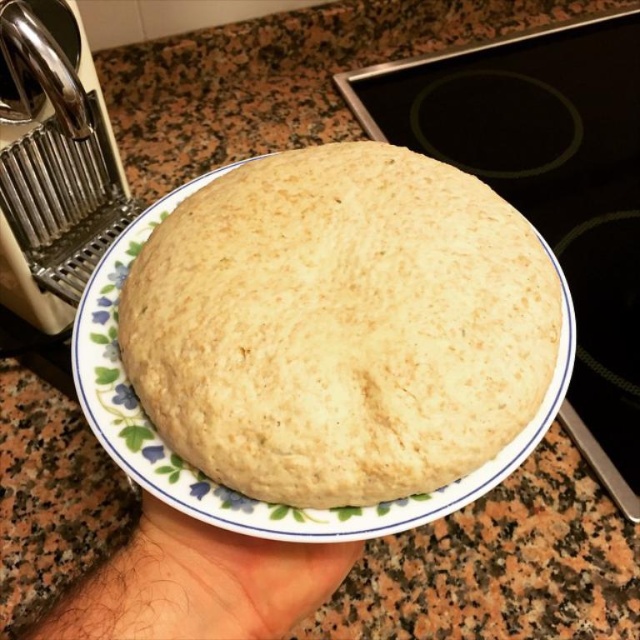
You are trying to determine if the golden matte bread at center will fit into the space between the brushed metal pasta machine at upper left and the edge of the counter. Based on their heights, can it fit vertically?

The golden matte bread at center is shorter than the brushed metal pasta machine at upper left, so it can fit vertically between them as its height is less than the pasta machine.

What object is located at the coordinate point (52, 163) in the image?

The brushed metal pasta machine at upper left is located at the coordinate point (52, 163).